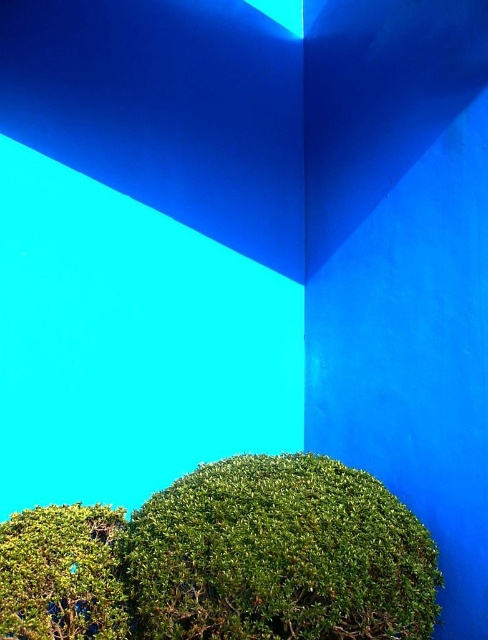
You are designing a garden layout and need to place both the green matte bush at lower center and the green matte bush at lower left. Which of the two requires more horizontal space due to its size?

The green matte bush at lower center requires more horizontal space because its width is larger than the green matte bush at lower left.

You are standing in front of the image and want to know how far the point at coordinates (x=224, y=557) is from your current position. Can you determine the distance?

The point at coordinates (x=224, y=557) is 10.13 feet away from the camera, so it is 10.13 feet away from your current position.

You are an architect designing a garden layout. You have a green matte bush at lower center that needs to be placed exactly at coordinates point (278, 556). Can you confirm if this placement aligns with the existing geometric blue planes above it?

The point (278, 556) marks the green matte bush at lower center, so the placement aligns with the existing geometric blue planes above it.